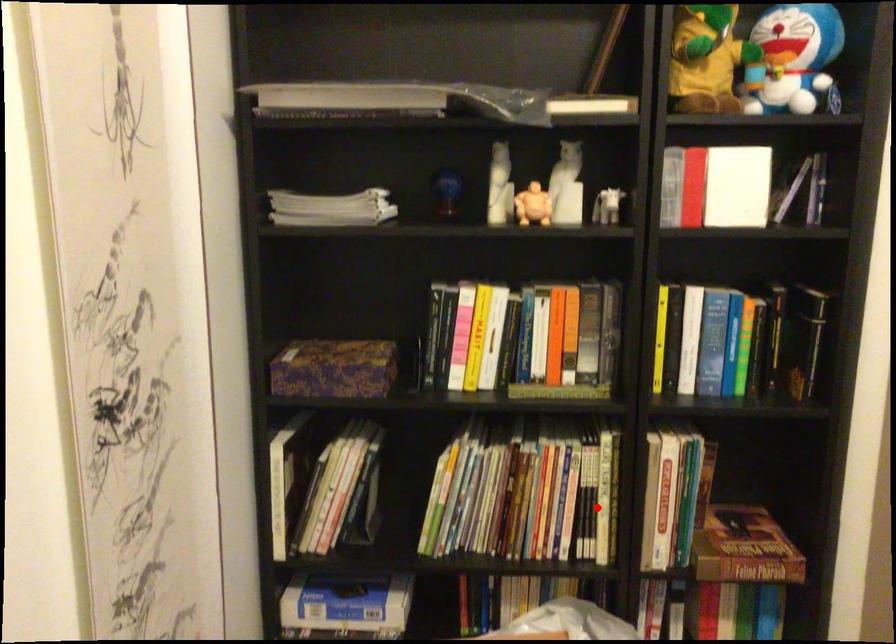
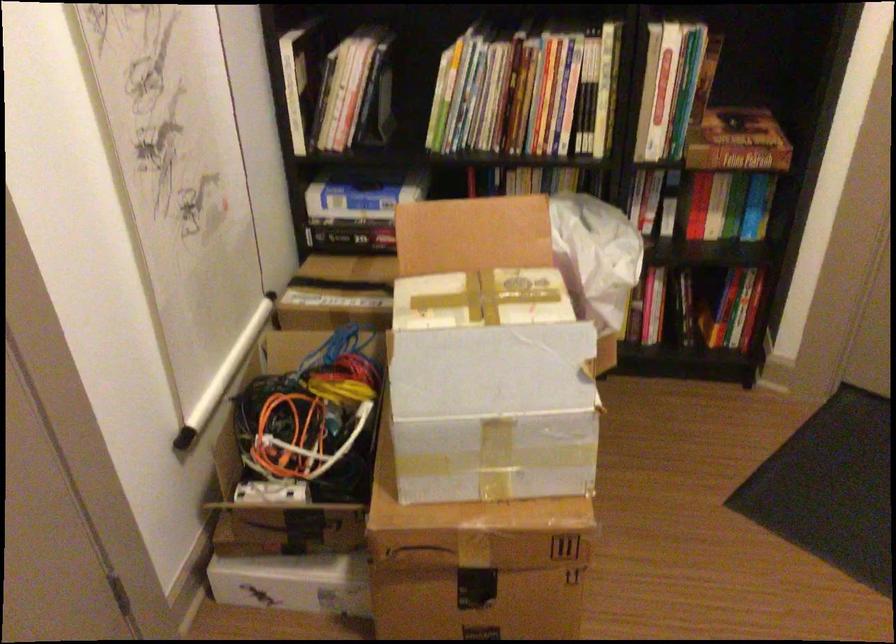
Where in the second image is the point corresponding to the highlighted location from the first image?

(595, 100)